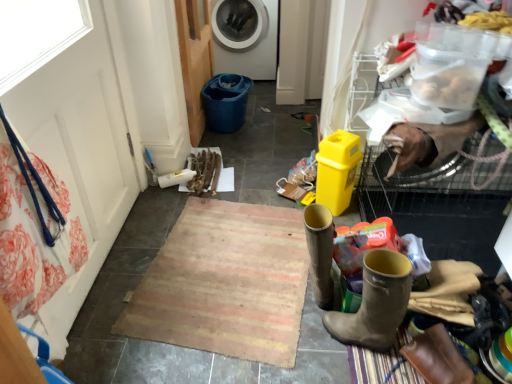
Question: Considering the relative sizes of rustic woven mat at center and white plastic washing machine at upper center in the image provided, is rustic woven mat at center wider than white plastic washing machine at upper center?

Choices:
 (A) yes
 (B) no

Answer: (B)

Question: From a real-world perspective, is rustic woven mat at center physically above white plastic washing machine at upper center?

Choices:
 (A) no
 (B) yes

Answer: (A)

Question: Is rustic woven mat at center positioned in front of white plastic washing machine at upper center?

Choices:
 (A) yes
 (B) no

Answer: (A)

Question: Is rustic woven mat at center far from white plastic washing machine at upper center?

Choices:
 (A) no
 (B) yes

Answer: (B)

Question: Are rustic woven mat at center and white plastic washing machine at upper center beside each other?

Choices:
 (A) yes
 (B) no

Answer: (B)

Question: Visually, is brown leather boot at lower right, placed as the second footwear when sorted from left to right, positioned to the left or to the right of wooden screen door at upper left, the 2th screen door viewed from the front?

Choices:
 (A) left
 (B) right

Answer: (B)

Question: From a real-world perspective, is brown leather boot at lower right, the 1th footwear viewed from the right, physically located above or below wooden screen door at upper left, the 2th screen door viewed from the front?

Choices:
 (A) below
 (B) above

Answer: (A)

Question: In the image, is brown leather boot at lower right, the 1th footwear viewed from the right, positioned in front of or behind wooden screen door at upper left, acting as the 1th screen door starting from the right?

Choices:
 (A) front
 (B) behind

Answer: (A)

Question: Is brown leather boot at lower right, placed as the second footwear when sorted from left to right, taller or shorter than wooden screen door at upper left, the 2th screen door viewed from the front?

Choices:
 (A) tall
 (B) short

Answer: (B)

Question: From the image's perspective, relative to brown leather boot at lower right, which is the first footwear in left-to-right order, is white plastic washing machine at upper center above or below?

Choices:
 (A) below
 (B) above

Answer: (B)

Question: Is white plastic washing machine at upper center in front of or behind brown leather boot at lower right, which is the first footwear in left-to-right order, in the image?

Choices:
 (A) front
 (B) behind

Answer: (B)

Question: Choose the correct answer: Is white plastic washing machine at upper center inside brown leather boot at lower right, the second footwear in the right-to-left sequence, or outside it?

Choices:
 (A) outside
 (B) inside

Answer: (A)

Question: Considering the positions of point (266, 51) and point (330, 251), is point (266, 51) closer or farther from the camera than point (330, 251)?

Choices:
 (A) closer
 (B) farther

Answer: (B)

Question: Is point (203, 77) closer or farther from the camera than point (318, 274)?

Choices:
 (A) closer
 (B) farther

Answer: (B)

Question: Is wooden screen door at upper left, acting as the 1th screen door starting from the right, inside or outside of brown leather boot at lower right, which is the first footwear in left-to-right order?

Choices:
 (A) inside
 (B) outside

Answer: (B)